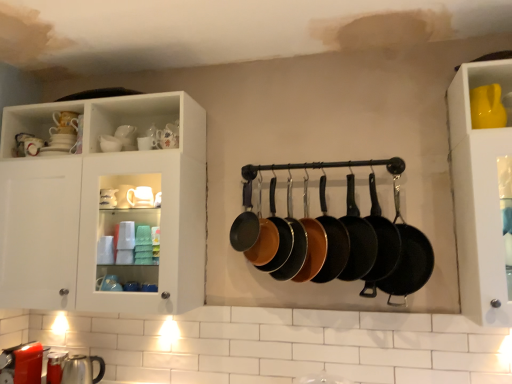
Question: From a real-world perspective, relative to black cast iron frying pan at center, placed as the ninth frying pan when sorted from left to right, is matte ceramic cups at upper center, placed as the 2th tableware when sorted from top to bottom, vertically above or below?

Choices:
 (A) below
 (B) above

Answer: (B)

Question: Would you say matte ceramic cups at upper center, the 3th tableware in the bottom-to-top sequence, is inside or outside black cast iron frying pan at center, which is the 1th frying pan in right-to-left order?

Choices:
 (A) outside
 (B) inside

Answer: (A)

Question: Estimate the real-world distances between objects in this image. Which object is farther from the matte black frying pan at center, positioned as the seventh frying pan in left-to-right order?

Choices:
 (A) white glossy cup at upper center, acting as the 3th tableware starting from the right
 (B) white glossy cabinet at upper left
 (C) metallic silver kettle at lower left, which ranks as the fourth tableware in top-to-bottom order
 (D) matte black frying pan at center, which is the fourth frying pan in left-to-right order
 (E) matte black frying pan at center, marked as the fifth frying pan in a right-to-left arrangement

Answer: (C)

Question: Estimate the real-world distances between objects in this image. Which object is closer to the matte black frying pan at center, which is the fourth frying pan in left-to-right order?

Choices:
 (A) shiny black frying pan at center, marked as the 9th frying pan in a right-to-left arrangement
 (B) matte brown frying pan at center, which is the second frying pan from left to right
 (C) black cast iron frying pan at center, placed as the ninth frying pan when sorted from left to right
 (D) white glossy cabinet at upper left
 (E) metallic silver kettle at lower left, the third tableware when ordered from back to front

Answer: (B)